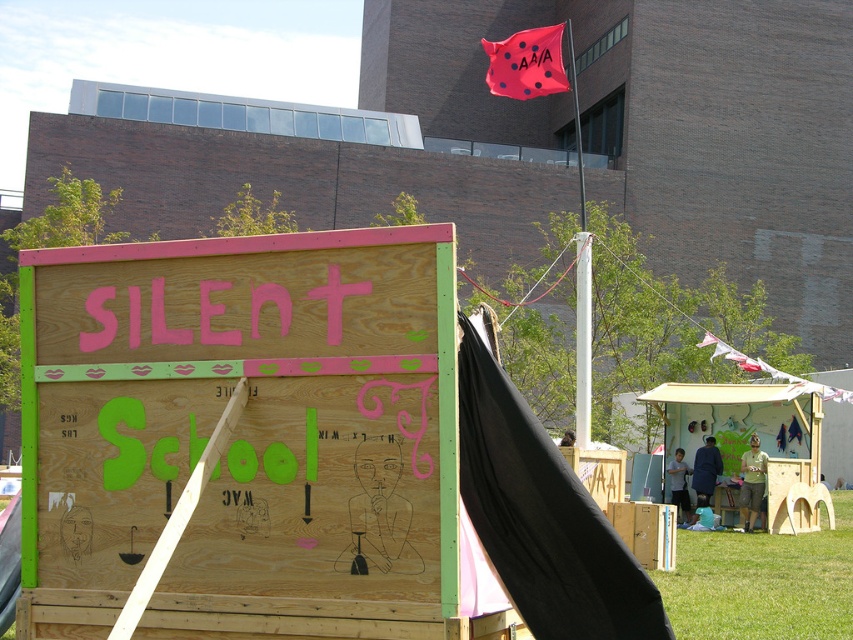
Question: Is wooden signboard at center further to camera compared to red fabric flag at upper right?

Choices:
 (A) yes
 (B) no

Answer: (B)

Question: Which of the following is the farthest from the observer?

Choices:
 (A) pink fabric flag at upper center
 (B) wooden signboard at center
 (C) red fabric flag at upper right
 (D) green grass at lower right

Answer: (C)

Question: Considering the relative positions of green grass at lower right and red fabric flag at upper right in the image provided, where is green grass at lower right located with respect to red fabric flag at upper right?

Choices:
 (A) right
 (B) left

Answer: (B)

Question: Which object is the farthest from the red fabric flag at upper right?

Choices:
 (A) wooden signboard at center
 (B) pink fabric flag at upper center
 (C) green grass at lower right

Answer: (A)

Question: Does wooden signboard at center have a lesser width compared to pink fabric flag at upper center?

Choices:
 (A) yes
 (B) no

Answer: (A)

Question: Which point is farther to the camera?

Choices:
 (A) pink fabric flag at upper center
 (B) wooden signboard at center
 (C) red fabric flag at upper right
 (D) green grass at lower right

Answer: (C)